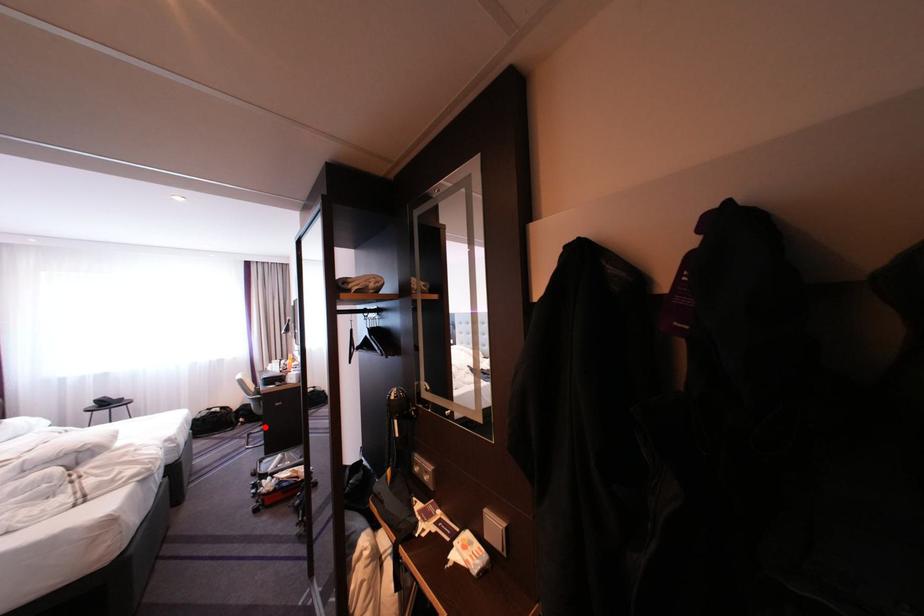
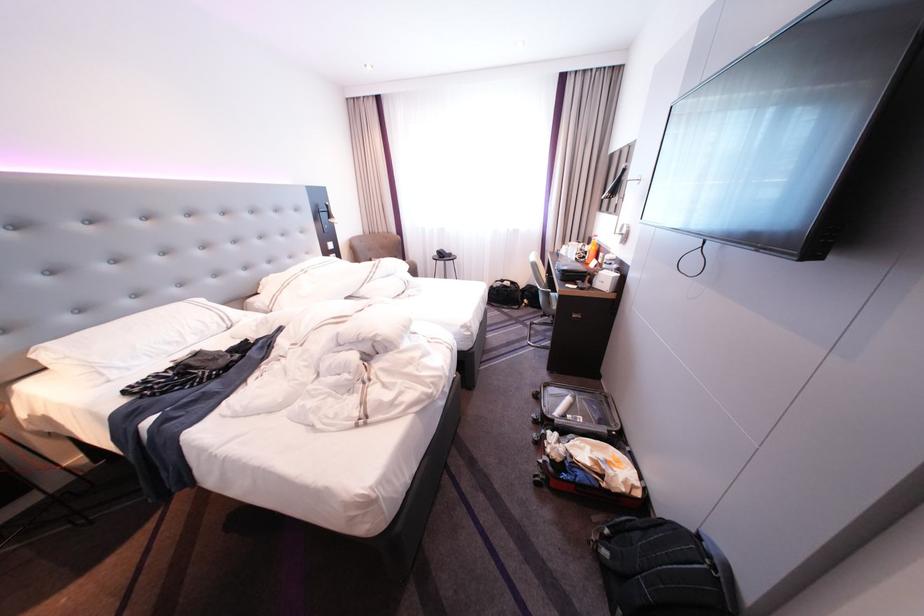
Question: I am providing you with two images of the same scene from different viewpoints. Image1 has a red point marked. In image2, the corresponding 3D location appears at what relative position? Reply with the corresponding letter.

Choices:
 (A) Closer
 (B) Farther

Answer: (A)